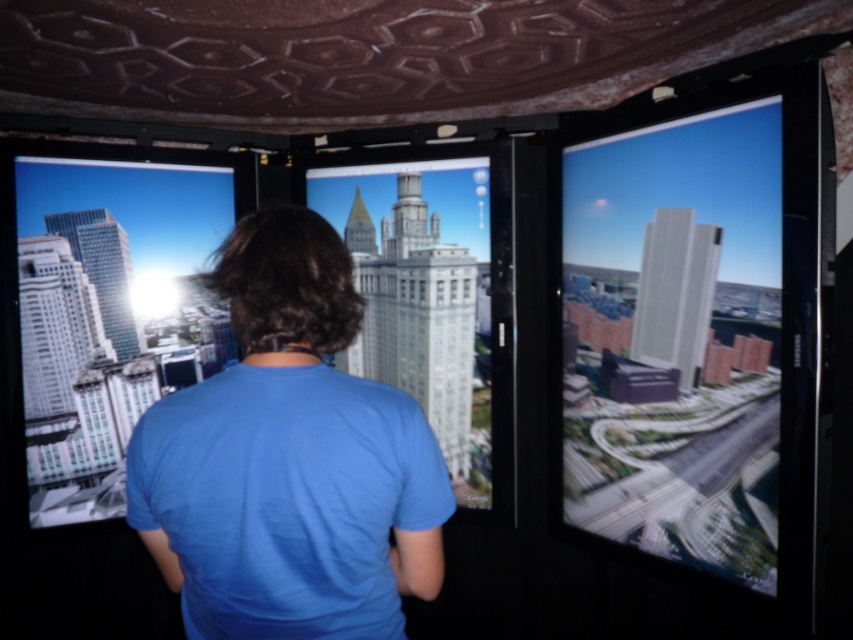
You are a photographer trying to capture the smooth glass skyscraper at right and the blue cotton shirt at center in a single frame. Based on their sizes in the image, which object would appear taller in the photo?

The smooth glass skyscraper at right appears taller than the blue cotton shirt at center in the image.

You are an interior designer planning to place two white glossy buildings in a model city. The first is labeled as the white glossy building at left and the second as the white glossy building at center. Given that the minimum required distance between any two buildings in your model is 25 inches, will the current spacing between them meet the requirement?

The white glossy building at left is 26.50 inches from the white glossy building at center, which exceeds the minimum required distance of 25 inches. Therefore, the spacing between them meets the requirement.

You are an interior designer assessing the layout of a room. You notice the blue cotton shirt at center and the white glossy building at left. Which object is wider?

The white glossy building at left is wider than the blue cotton shirt at center.